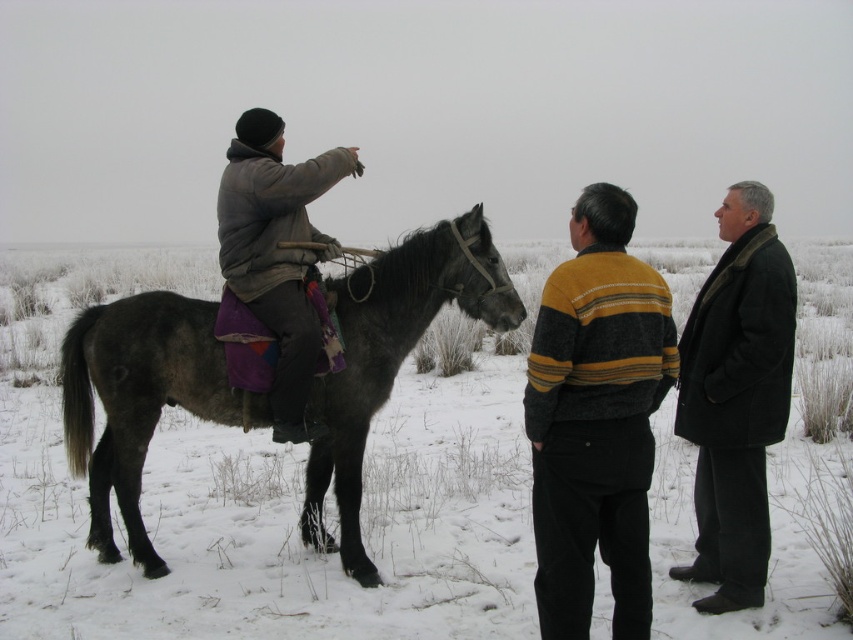
Which is more to the left, dark gray wool coat at right or gray woolen jacket at left?

gray woolen jacket at left is more to the left.

Who is lower down, dark gray wool coat at right or gray woolen jacket at left?

dark gray wool coat at right is lower down.

Describe the element at coordinates (735, 397) in the screenshot. I see `dark gray wool coat at right` at that location.

Find the location of `dark gray wool coat at right`. dark gray wool coat at right is located at coordinates (735, 397).

Measure the distance between striped wool sweater at center and dark gray wool coat at right.

striped wool sweater at center is 37.59 inches away from dark gray wool coat at right.

Can you confirm if striped wool sweater at center is bigger than dark gray wool coat at right?

Actually, striped wool sweater at center might be smaller than dark gray wool coat at right.

At what (x,y) coordinates should I click in order to perform the action: click on striped wool sweater at center. Please return your answer as a coordinate pair (x, y). Looking at the image, I should click on (596, 419).

Locate an element on the screen. The width and height of the screenshot is (853, 640). striped wool sweater at center is located at coordinates (596, 419).

Which is more to the right, dark gray fur horse at left or striped wool sweater at center?

striped wool sweater at center

Is point (135, 529) positioned before point (672, 371)?

No, it is not.

This screenshot has height=640, width=853. What do you see at coordinates (392, 356) in the screenshot?
I see `dark gray fur horse at left` at bounding box center [392, 356].

Where is `dark gray fur horse at left`? The height and width of the screenshot is (640, 853). dark gray fur horse at left is located at coordinates (392, 356).